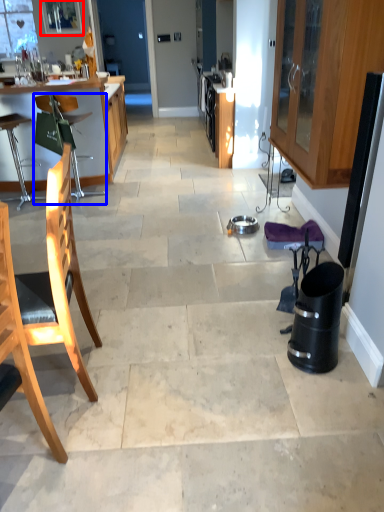
Question: Among these objects, which one is farthest to the camera, window screen (highlighted by a red box) or chair (highlighted by a blue box)?

Choices:
 (A) window screen
 (B) chair

Answer: (A)